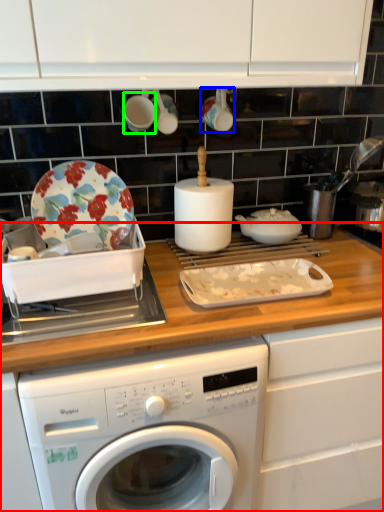
Question: Considering the real-world distances, which object is farthest from countertop (highlighted by a red box)? tableware (highlighted by a blue box) or tableware (highlighted by a green box)?

Choices:
 (A) tableware
 (B) tableware

Answer: (B)